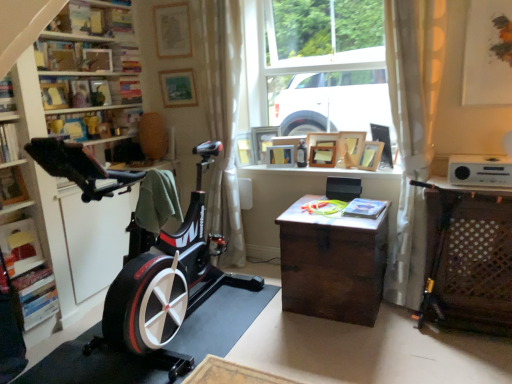
Question: Would you say wooden picture frame at upper center, the ninth picture frame in the right-to-left sequence, contains wooden chest at right?

Choices:
 (A) no
 (B) yes

Answer: (A)

Question: Is wooden picture frame at upper center, the ninth picture frame in the right-to-left sequence, positioned in front of wooden chest at right?

Choices:
 (A) yes
 (B) no

Answer: (B)

Question: Does wooden picture frame at upper center, which ranks as the 3th picture frame in left-to-right order, have a smaller size compared to wooden chest at right?

Choices:
 (A) yes
 (B) no

Answer: (A)

Question: Is wooden picture frame at upper center, which ranks as the 3th picture frame in left-to-right order, positioned far away from wooden chest at right?

Choices:
 (A) yes
 (B) no

Answer: (A)

Question: Can you confirm if wooden picture frame at upper center, the ninth picture frame in the right-to-left sequence, is positioned to the left of wooden chest at right?

Choices:
 (A) no
 (B) yes

Answer: (B)

Question: Is wooden picture frame at upper center, the ninth picture frame in the right-to-left sequence, bigger than wooden chest at right?

Choices:
 (A) yes
 (B) no

Answer: (B)

Question: Considering the relative positions of matte wooden picture frame at upper center, positioned as the 10th picture frame in right-to-left order, and wooden picture frame at upper center, the ninth picture frame in the right-to-left sequence, in the image provided, is matte wooden picture frame at upper center, positioned as the 10th picture frame in right-to-left order, to the left of wooden picture frame at upper center, the ninth picture frame in the right-to-left sequence, from the viewer's perspective?

Choices:
 (A) no
 (B) yes

Answer: (B)

Question: Is matte wooden picture frame at upper center, positioned as the 10th picture frame in right-to-left order, shorter than wooden picture frame at upper center, which ranks as the 3th picture frame in left-to-right order?

Choices:
 (A) yes
 (B) no

Answer: (A)

Question: From the image's perspective, is matte wooden picture frame at upper center, positioned as the 10th picture frame in right-to-left order, located beneath wooden picture frame at upper center, which ranks as the 3th picture frame in left-to-right order?

Choices:
 (A) yes
 (B) no

Answer: (B)

Question: From the image's perspective, is matte wooden picture frame at upper center, which appears as the second picture frame when viewed from the left, over wooden picture frame at upper center, the ninth picture frame in the right-to-left sequence?

Choices:
 (A) yes
 (B) no

Answer: (A)

Question: Is matte wooden picture frame at upper center, which appears as the second picture frame when viewed from the left, next to wooden picture frame at upper center, which ranks as the 3th picture frame in left-to-right order?

Choices:
 (A) no
 (B) yes

Answer: (A)

Question: Does matte wooden picture frame at upper center, positioned as the 10th picture frame in right-to-left order, come behind wooden picture frame at upper center, which ranks as the 3th picture frame in left-to-right order?

Choices:
 (A) yes
 (B) no

Answer: (A)

Question: Can you confirm if white sheer curtain at center, arranged as the 1th curtain when viewed from the left, is taller than wooden chest at center?

Choices:
 (A) yes
 (B) no

Answer: (A)